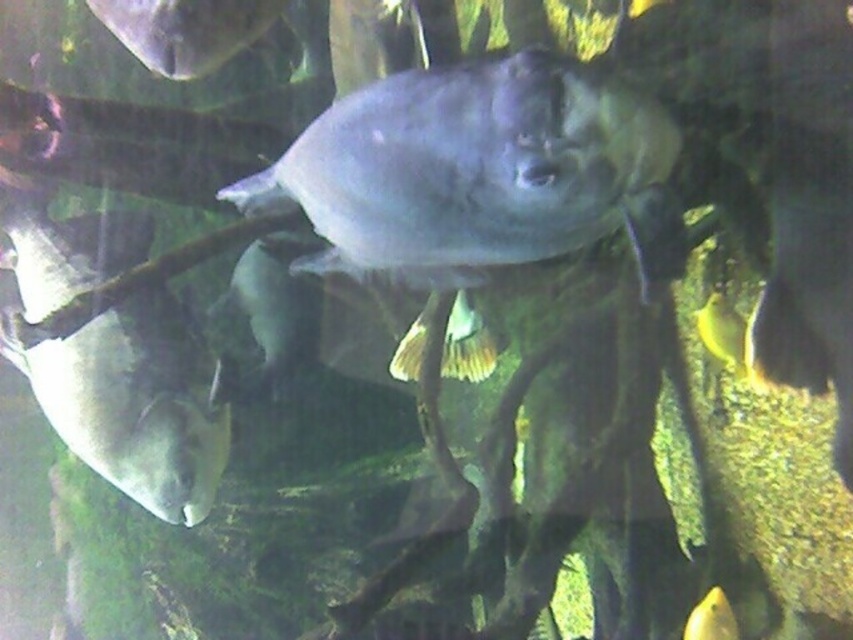
Question: Where is shiny silver fish at center located in relation to matte gray fish at upper left in the image?

Choices:
 (A) below
 (B) above

Answer: (A)

Question: Does shiny silver fish at center have a larger size compared to matte gray fish at lower left?

Choices:
 (A) no
 (B) yes

Answer: (A)

Question: Which object appears farthest from the camera in this image?

Choices:
 (A) matte gray fish at lower left
 (B) shiny silver fish at center
 (C) matte gray fish at upper left
 (D) yellow matte fish at lower right

Answer: (A)

Question: Which point is closer to the camera?

Choices:
 (A) shiny silver fish at center
 (B) matte gray fish at upper left
 (C) matte gray fish at lower left
 (D) yellow matte fish at lower right

Answer: (A)

Question: Is matte gray fish at lower left bigger than matte gray fish at upper left?

Choices:
 (A) yes
 (B) no

Answer: (A)

Question: Which of the following is the farthest from the observer?

Choices:
 (A) (135, 497)
 (B) (462, 161)
 (C) (711, 596)
 (D) (117, 26)

Answer: (A)